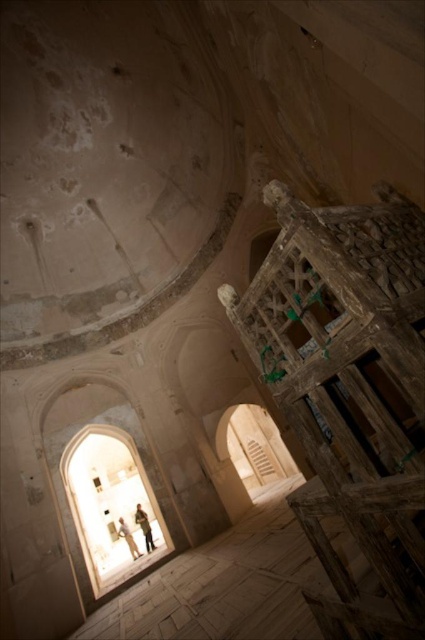
You are standing in the historical building and see a light brown leather jacket at lower center and a light beige fabric person at lower center. Which object is closer to you?

The light brown leather jacket at lower center is closer to you because it is in front of the light beige fabric person at lower center.

You are standing in the historical building and notice a light brown leather jacket at lower center and a light beige fabric person at lower center. Which object is shorter?

The light brown leather jacket at lower center is shorter than the light beige fabric person at lower center.

In the scene shown: You are standing in a historical building and see a light brown leather jacket at lower center and a light beige fabric person at lower center. Which object is covering the other one?

The light brown leather jacket at lower center is positioned over the light beige fabric person at lower center, so it is covering the person.